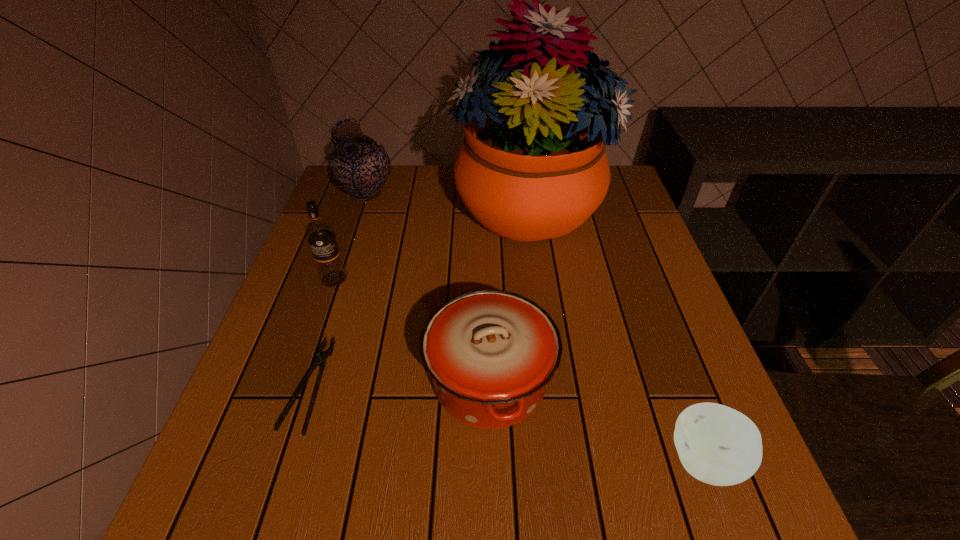
This screenshot has height=540, width=960. What are the coordinates of `free spot between the apple and the tallest object` in the screenshot? It's located at (616, 334).

Where is `vacant area that lies between the shortest object and the tallest object`? vacant area that lies between the shortest object and the tallest object is located at coordinates (418, 296).

Locate an element on the screen. The image size is (960, 540). vacant region between the tongs and the pottery is located at coordinates (337, 290).

Locate an element on the screen. free point between the pottery and the third farthest object is located at coordinates (350, 237).

Choose which object is the fourth nearest neighbor to the tallest object. Please provide its 2D coordinates. Your answer should be formatted as a tuple, i.e. [(x, y)], where the tuple contains the x and y coordinates of a point satisfying the conditions above.

[(320, 361)]

Select which object is the fifth closest to the fifth tallest object. Please provide its 2D coordinates. Your answer should be formatted as a tuple, i.e. [(x, y)], where the tuple contains the x and y coordinates of a point satisfying the conditions above.

[(359, 166)]

Where is `vacant point that satisfies the following two spatial constraints: 1. on the label of the casserole; 2. on the left side of the third farthest object`? This screenshot has height=540, width=960. vacant point that satisfies the following two spatial constraints: 1. on the label of the casserole; 2. on the left side of the third farthest object is located at coordinates (300, 380).

This screenshot has width=960, height=540. Find the location of `free spot that satisfies the following two spatial constraints: 1. on the front side of the second shortest object; 2. on the right side of the pottery`. free spot that satisfies the following two spatial constraints: 1. on the front side of the second shortest object; 2. on the right side of the pottery is located at coordinates (277, 461).

Identify the location of free space that satisfies the following two spatial constraints: 1. on the label of the fourth nearest object; 2. on the right side of the apple. (272, 461).